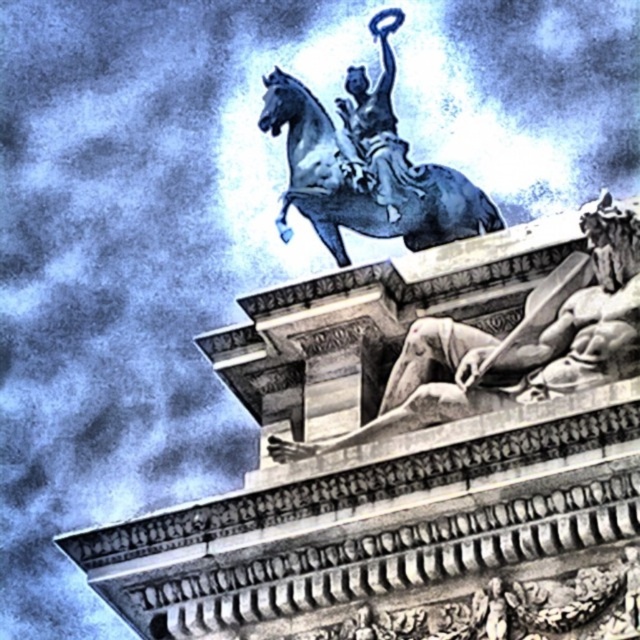
Where is `smooth stone reclining figure at center`? smooth stone reclining figure at center is located at coordinates (515, 342).

Which is in front, point (449, 328) or point (317, 118)?

Point (449, 328)

You are a GUI agent. You are given a task and a screenshot of the screen. Output one action in this format:
    pyautogui.click(x=<x>, y=<y>)
    Task: Click on the smooth stone reclining figure at center
    The width and height of the screenshot is (640, 640).
    Given the screenshot: What is the action you would take?
    pyautogui.click(x=515, y=342)